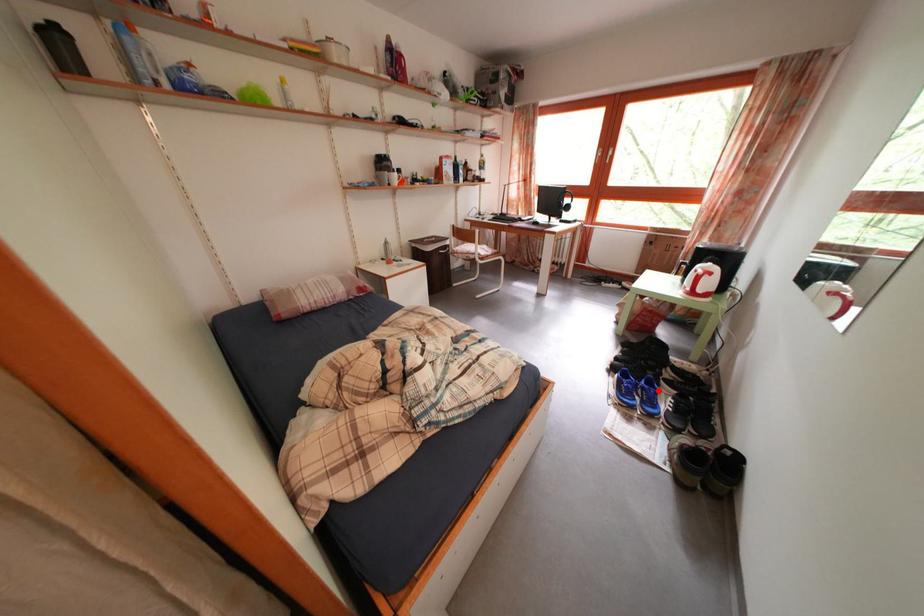
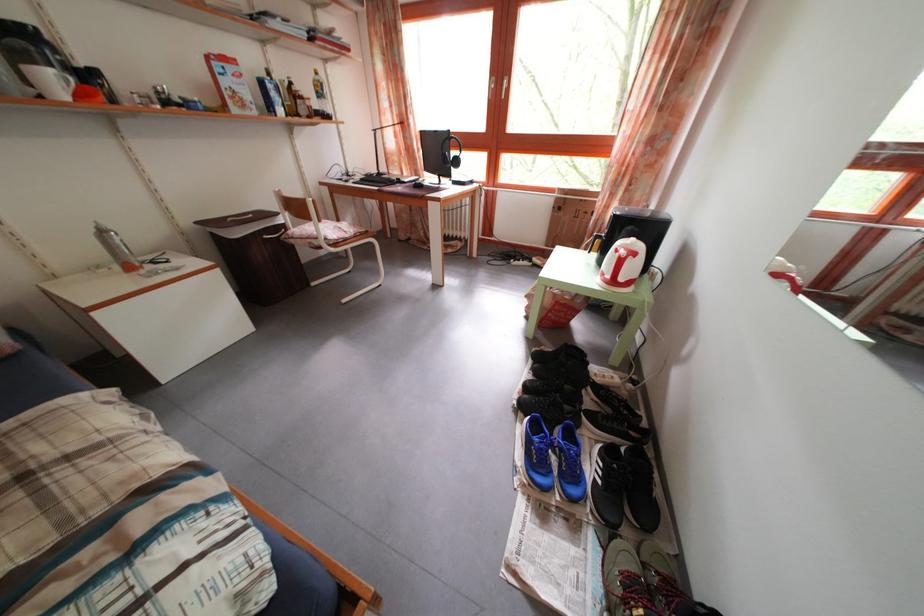
Find the pixel in the second image that matches the highlighted location in the first image.

(578, 444)